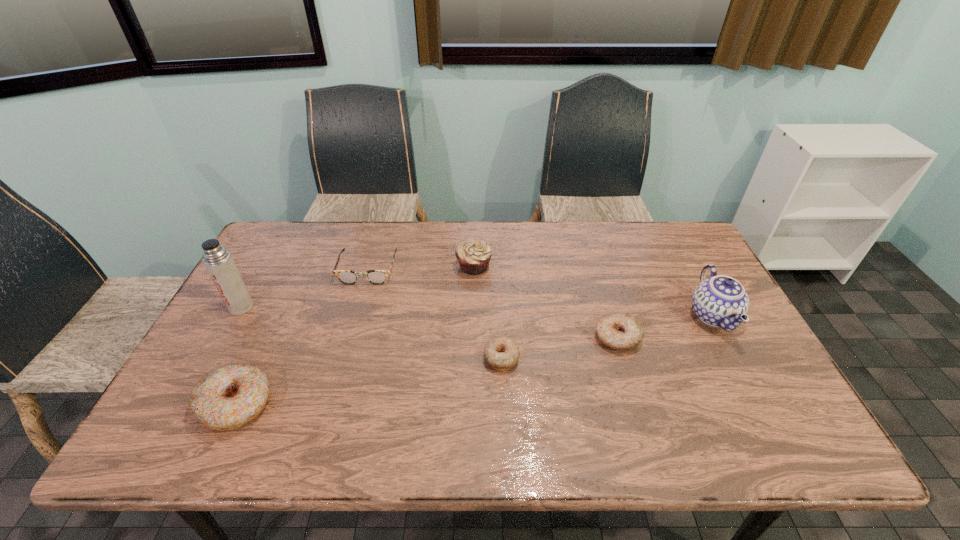
Identify the location of vacant space in between the tallest object and the tallest doughnut. (238, 356).

Find the location of `object that is the second closest to the sixth object from left to right`. object that is the second closest to the sixth object from left to right is located at coordinates (502, 353).

Point out which object is positioned as the fifth nearest to the thermos bottle. Please provide its 2D coordinates. Your answer should be formatted as a tuple, i.e. [(x, y)], where the tuple contains the x and y coordinates of a point satisfying the conditions above.

[(620, 331)]

Find the location of a particular element. doughnut that is the second closest one to the thermos bottle is located at coordinates (502, 353).

Choose which doughnut is the nearest neighbor to the spectacles. Please provide its 2D coordinates. Your answer should be formatted as a tuple, i.e. [(x, y)], where the tuple contains the x and y coordinates of a point satisfying the conditions above.

[(230, 396)]

This screenshot has width=960, height=540. Identify the location of vacant region that satisfies the following two spatial constraints: 1. on the front side of the muffin; 2. on the right side of the shortest doughnut. (472, 357).

Where is `free location that satisfies the following two spatial constraints: 1. at the spout of the rightmost object; 2. on the front side of the fourth shortest object`? The height and width of the screenshot is (540, 960). free location that satisfies the following two spatial constraints: 1. at the spout of the rightmost object; 2. on the front side of the fourth shortest object is located at coordinates (760, 404).

Where is `blank space that satisfies the following two spatial constraints: 1. on the front side of the thermos bottle; 2. on the right side of the nearest doughnut`? Image resolution: width=960 pixels, height=540 pixels. blank space that satisfies the following two spatial constraints: 1. on the front side of the thermos bottle; 2. on the right side of the nearest doughnut is located at coordinates (187, 404).

Identify the location of blank area in the image that satisfies the following two spatial constraints: 1. on the frame of the fifth object from right to left; 2. on the left side of the second doughnut from left to right. The height and width of the screenshot is (540, 960). (343, 357).